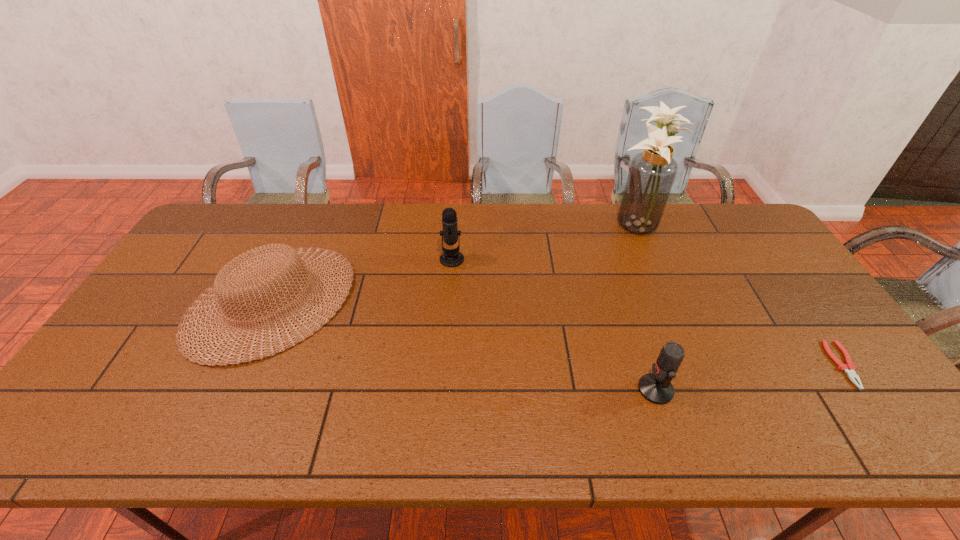
Identify the location of vacant space situated on the right of the tallest object. (x=682, y=224).

The height and width of the screenshot is (540, 960). Identify the location of blank space located 0.270m on the back of the left microphone. (456, 204).

I want to click on blank space located on the side of the right microphone with the red ring, so click(x=498, y=389).

This screenshot has width=960, height=540. I want to click on free space located on the side of the right microphone with the red ring, so click(x=588, y=389).

You are a GUI agent. You are given a task and a screenshot of the screen. Output one action in this format:
    pyautogui.click(x=<x>, y=<y>)
    Task: Click on the free region located 0.380m on the side of the right microphone with the red ring
    The width and height of the screenshot is (960, 540).
    Given the screenshot: What is the action you would take?
    pyautogui.click(x=481, y=389)

Find the location of a particular element. Image resolution: width=960 pixels, height=540 pixels. vacant space located on the back of the second shortest object is located at coordinates (311, 216).

Where is `vacant space located 0.240m on the back of the shortest object`? Image resolution: width=960 pixels, height=540 pixels. vacant space located 0.240m on the back of the shortest object is located at coordinates (782, 278).

Locate an element on the screen. This screenshot has width=960, height=540. object that is at the far edge is located at coordinates (652, 172).

At what (x,y) coordinates should I click in order to perform the action: click on object at the left edge. Please return your answer as a coordinate pair (x, y). Looking at the image, I should click on (244, 274).

Image resolution: width=960 pixels, height=540 pixels. I want to click on object at the right edge, so click(849, 368).